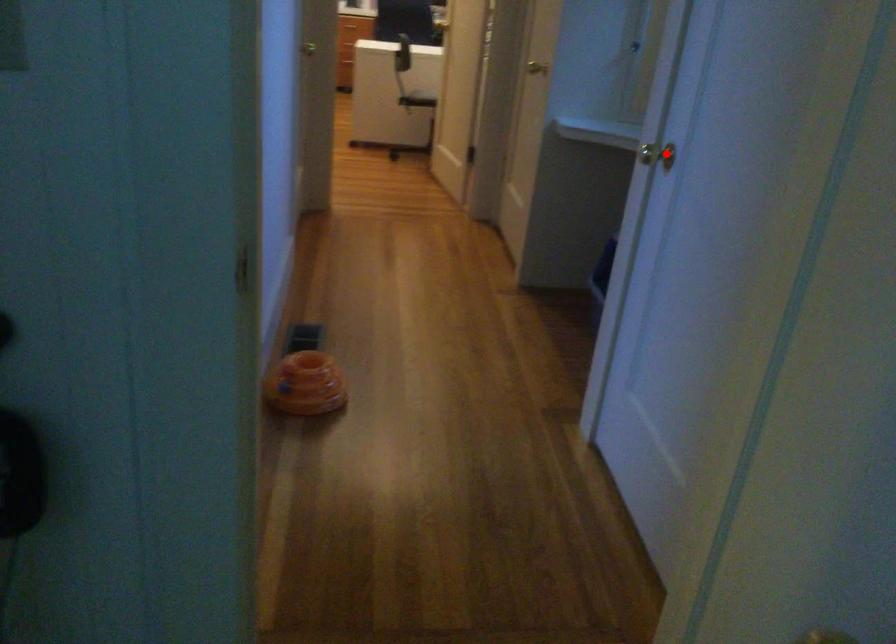
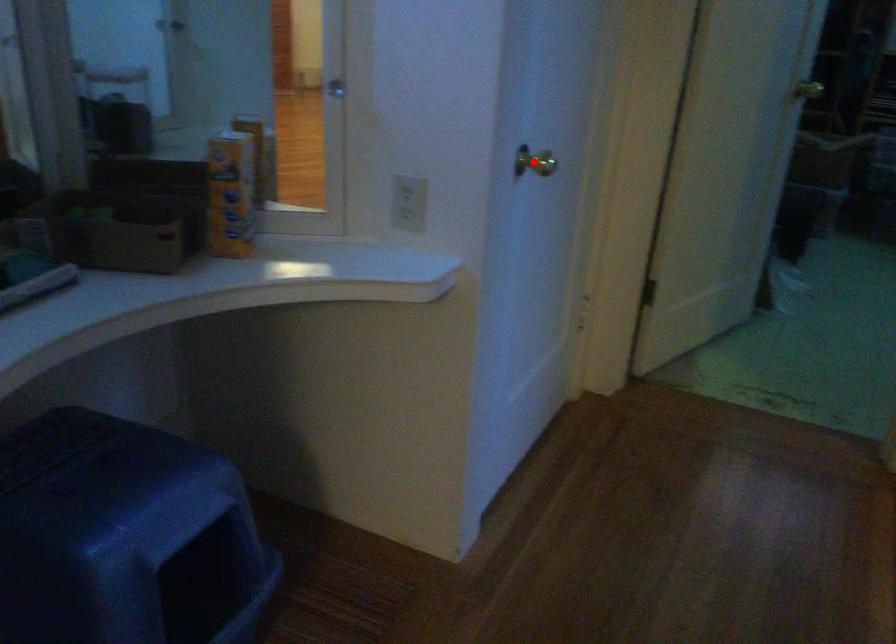
I am providing you with two images of the same scene from different viewpoints. A red point is marked on the first image and another point is marked on the second image. Are the points marked in image1 and image2 representing the same 3D position?

Yes